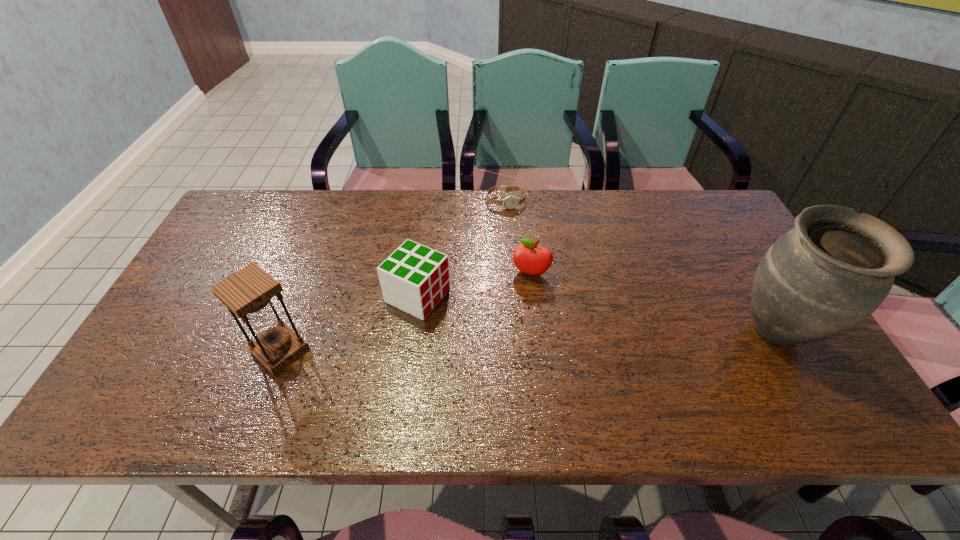
Identify the location of free region located on the face of the shortest object. Image resolution: width=960 pixels, height=540 pixels. (514, 236).

At what (x,y) coordinates should I click in order to perform the action: click on vacant region located on the face of the shortest object. Please return your answer as a coordinate pair (x, y). Looking at the image, I should click on (526, 301).

Find the location of a particular element. The width and height of the screenshot is (960, 540). free point located 0.390m on the face of the shortest object is located at coordinates (526, 301).

Image resolution: width=960 pixels, height=540 pixels. What are the coordinates of `vacant region located 0.150m on the front-facing side of the apple` in the screenshot? It's located at (510, 321).

Where is `free space located on the front-facing side of the apple`? This screenshot has height=540, width=960. free space located on the front-facing side of the apple is located at coordinates (499, 349).

Image resolution: width=960 pixels, height=540 pixels. I want to click on vacant space positioned 0.200m on the front-facing side of the apple, so click(504, 336).

I want to click on free space located 0.280m on the red face of the fourth object from right to left, so click(543, 354).

Identify the location of free space located 0.290m on the red face of the fourth object from right to left. (547, 355).

Identify the location of vacant area situated on the red face of the fourth object from right to left. The height and width of the screenshot is (540, 960). (478, 323).

Where is `object at the far edge`? This screenshot has height=540, width=960. object at the far edge is located at coordinates (510, 202).